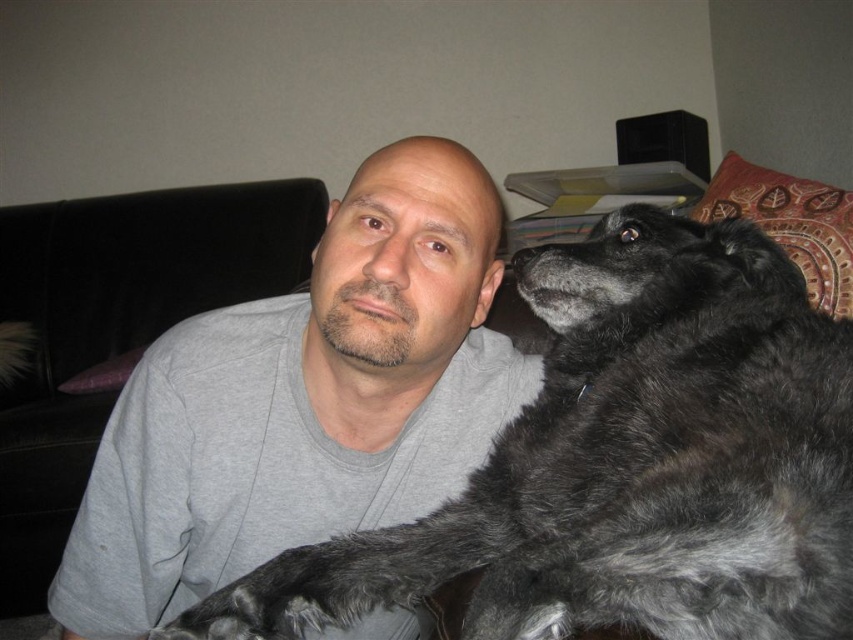
Question: Which of the following is the farthest from the observer?

Choices:
 (A) black leather couch at left
 (B) gray cotton shirt at center

Answer: (A)

Question: Which point is farther to the camera?

Choices:
 (A) (305, 237)
 (B) (733, 440)
 (C) (496, 371)

Answer: (A)

Question: Is fuzzy black dog at center below gray cotton shirt at center?

Choices:
 (A) yes
 (B) no

Answer: (B)

Question: Is gray cotton shirt at center further to the viewer compared to black leather couch at left?

Choices:
 (A) no
 (B) yes

Answer: (A)

Question: Is fuzzy black dog at center to the right of black leather couch at left from the viewer's perspective?

Choices:
 (A) no
 (B) yes

Answer: (B)

Question: Which of the following is the farthest from the observer?

Choices:
 (A) 715,410
 (B) 10,243

Answer: (B)